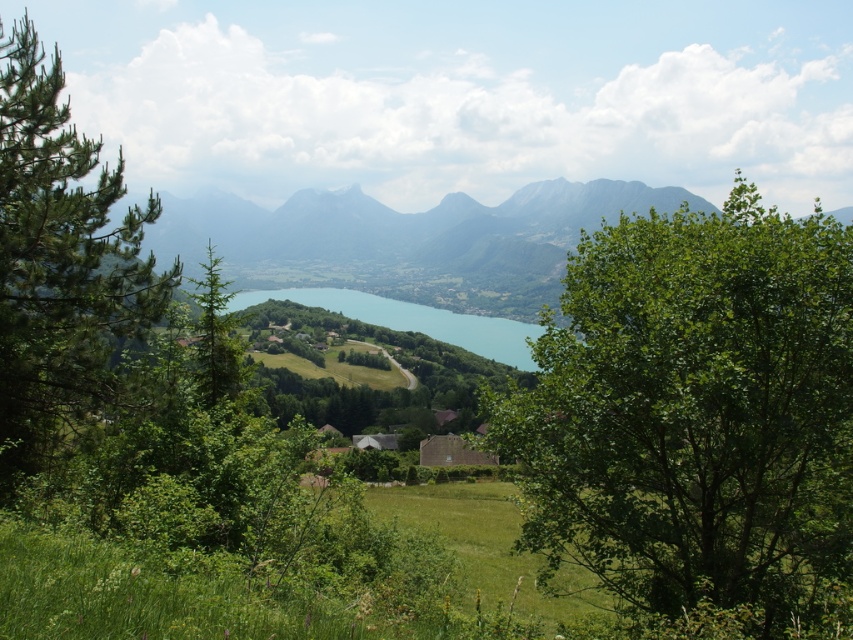
What do you see at coordinates (695, 413) in the screenshot? I see `green leafy tree at center` at bounding box center [695, 413].

Which is behind, point (822, 276) or point (91, 296)?

Positioned behind is point (91, 296).

Is point (548, 541) positioned behind point (97, 312)?

That is True.

Identify the location of green leafy tree at center. (695, 413).

From the picture: Can you confirm if green leafy tree at center is wider than turquoise glassy water at center?

No.

Is point (741, 456) more distant than point (227, 301)?

No, (741, 456) is closer to viewer.

Does point (769, 573) come in front of point (524, 352)?

Yes.

At what (x,y) coordinates should I click in order to perform the action: click on green leafy tree at center. Please return your answer as a coordinate pair (x, y). The height and width of the screenshot is (640, 853). Looking at the image, I should click on (695, 413).

Who is more distant from viewer, (x=28, y=38) or (x=502, y=344)?

Positioned behind is point (x=502, y=344).

Is green needle-like tree at left above turquoise glassy water at center?

Yes, green needle-like tree at left is above turquoise glassy water at center.

Between point (15, 237) and point (393, 301), which one is positioned behind?

The point (393, 301) is behind.

Find the location of a particular element. green needle-like tree at left is located at coordinates (59, 262).